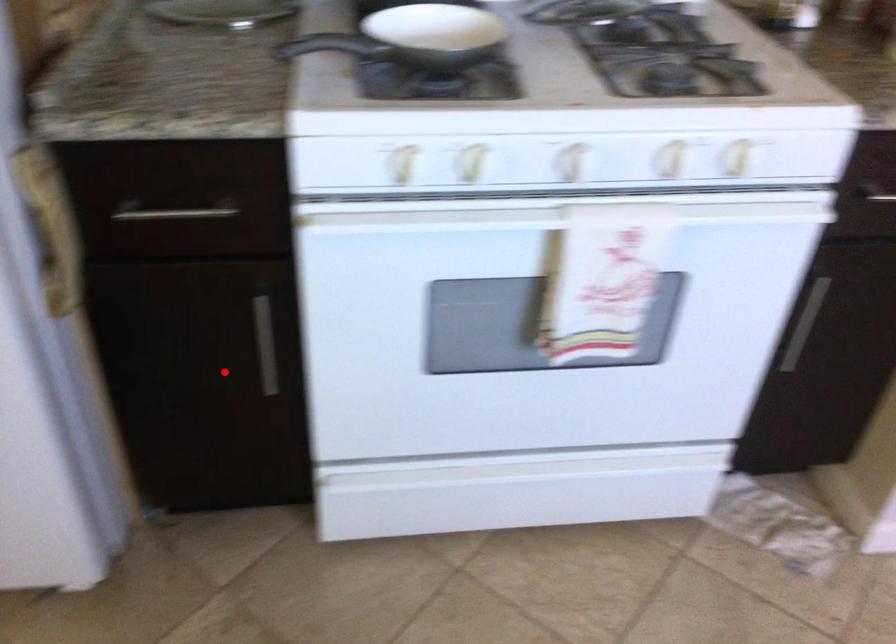
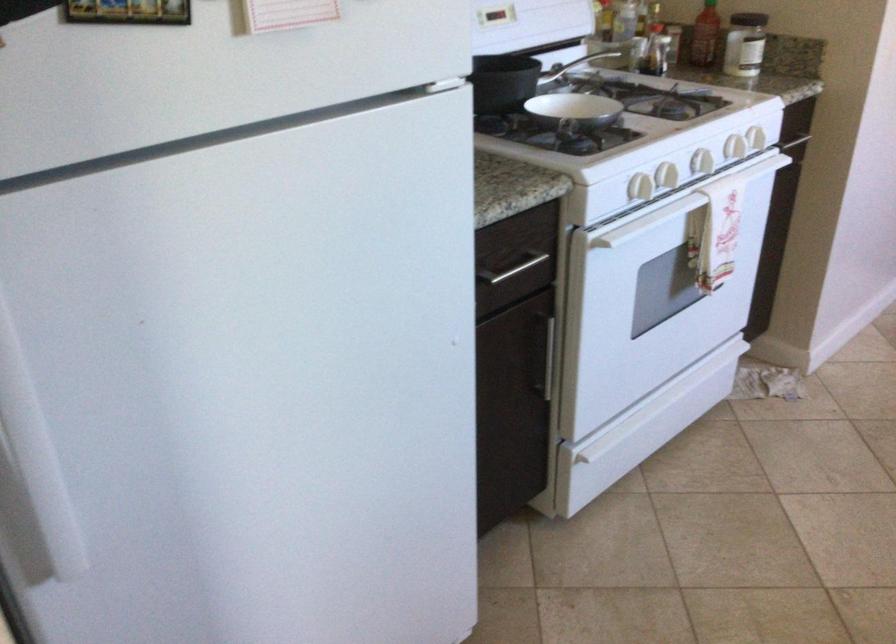
Question: I am providing you with two images of the same scene from different viewpoints. Given a red point in image1, look at the same physical point in image2. Is it:

Choices:
 (A) Closer to the viewpoint
 (B) Farther from the viewpoint

Answer: (B)